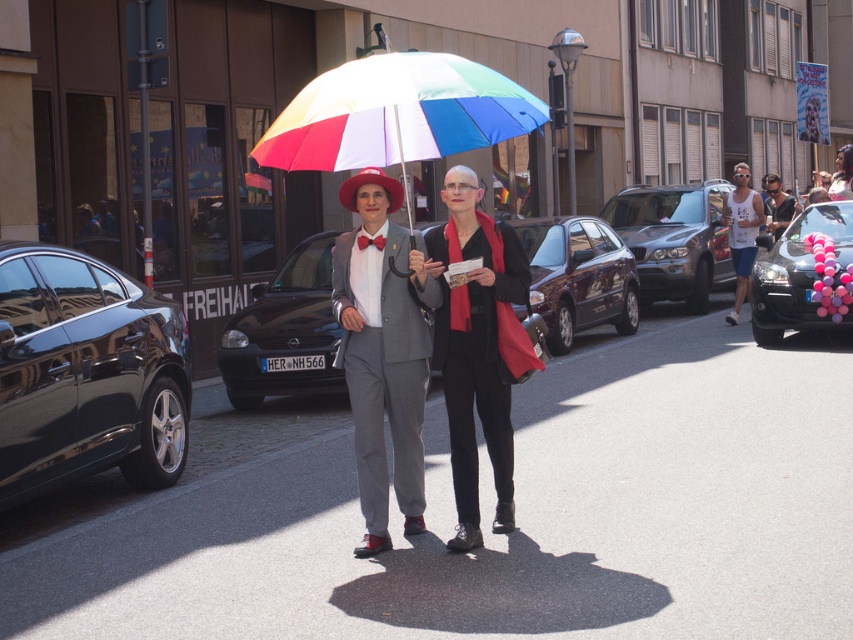
You are a pedestrian trying to cross the street where the glossy black car at left and the metallic silver suv at center are parked. Which vehicle is closer to the crosswalk?

The glossy black car at left is closer to the crosswalk because it is positioned in front of the metallic silver suv at center, meaning it is nearer to the crosswalk.

You are a photographer trying to capture both the black matte scarf at center and the shiny dark brown hatchback at center in a single shot. Given their size difference, which object will appear smaller in the photo?

The black matte scarf at center will appear smaller in the photo because it has a smaller size compared to the shiny dark brown hatchback at center.